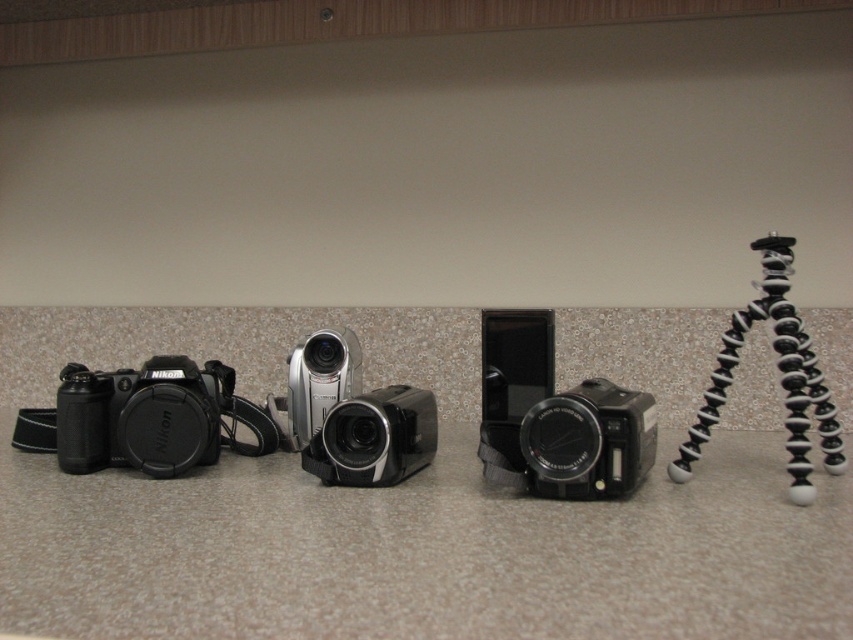
Question: Is black matte camera at left above black plastic camera at center?

Choices:
 (A) yes
 (B) no

Answer: (A)

Question: Which point is farther from the camera taking this photo?

Choices:
 (A) (341, 401)
 (B) (570, 420)
 (C) (292, 428)

Answer: (C)

Question: Is black plastic camera at center below silver metallic camcorder at center?

Choices:
 (A) yes
 (B) no

Answer: (A)

Question: Which object is closer to the camera taking this photo?

Choices:
 (A) black plastic camcorder at center
 (B) black rubberized tripod at right
 (C) silver metallic camcorder at center

Answer: (B)

Question: Which object appears closest to the camera in this image?

Choices:
 (A) black plastic camera at center
 (B) black plastic camcorder at center
 (C) silver metallic camcorder at center
 (D) black matte camera at left

Answer: (A)

Question: Where is black plastic camcorder at center located in relation to silver metallic camcorder at center in the image?

Choices:
 (A) above
 (B) below

Answer: (B)